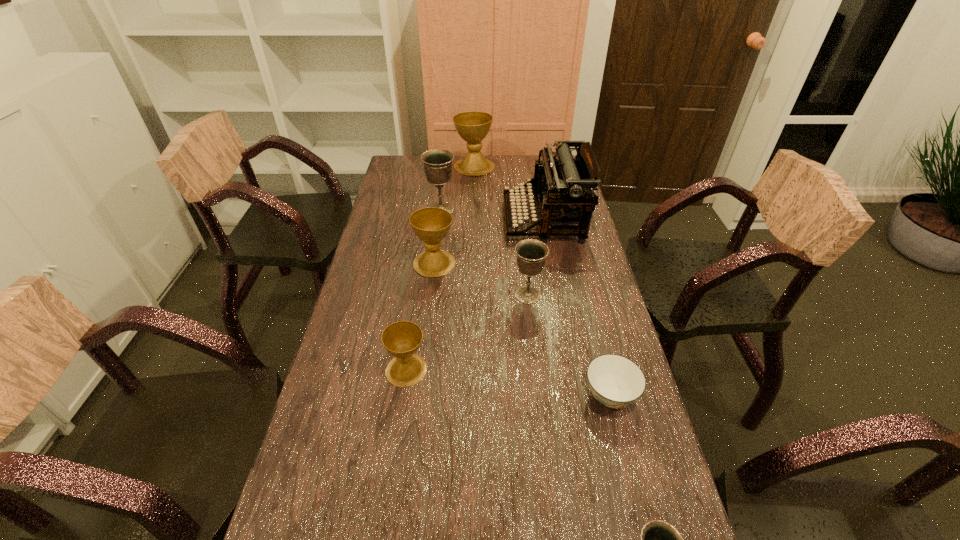
This screenshot has height=540, width=960. I want to click on brown chalice identified as the closest to the second biggest brown chalice, so click(401, 339).

Locate which bronze chalice ranks in proximity to the second smallest brown chalice. Please provide its 2D coordinates. Your answer should be formatted as a tuple, i.e. [(x, y)], where the tuple contains the x and y coordinates of a point satisfying the conditions above.

[(531, 253)]

Point out which bronze chalice is positioned as the nearest to the second chalice from right to left. Please provide its 2D coordinates. Your answer should be formatted as a tuple, i.e. [(x, y)], where the tuple contains the x and y coordinates of a point satisfying the conditions above.

[(437, 163)]

I want to click on vacant space that satisfies the following two spatial constraints: 1. on the back side of the fifth farthest chalice; 2. on the right side of the biggest brown chalice, so tap(437, 167).